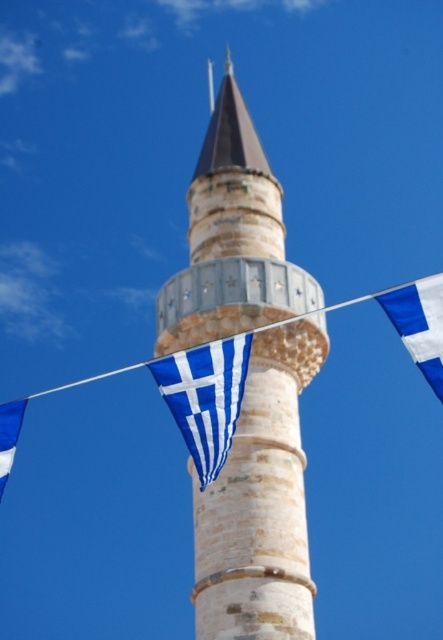
The image size is (443, 640). I want to click on blue striped flag at center, so click(x=205, y=397).

Does blue striped flag at center have a lesser width compared to blue fabric flag at right?

Yes, blue striped flag at center is thinner than blue fabric flag at right.

Does point (199, 456) come closer to viewer compared to point (427, 280)?

No, it is behind (427, 280).

Where is `blue striped flag at center`? blue striped flag at center is located at coordinates (205, 397).

How far apart are stone minaret at center and blue fabric flag at right?

stone minaret at center is 13.16 meters from blue fabric flag at right.

Who is more forward, (x=181, y=291) or (x=405, y=301)?

Point (x=405, y=301) is more forward.

Between point (253, 256) and point (431, 348), which one is positioned in front?

Positioned in front is point (431, 348).

Identify the location of stone minaret at center. This screenshot has width=443, height=640. (260, 502).

In the scene shown: Is stone minaret at center bigger than blue fabric flag at lower left?

Correct, stone minaret at center is larger in size than blue fabric flag at lower left.

Does stone minaret at center have a smaller size compared to blue fabric flag at lower left?

No, stone minaret at center is not smaller than blue fabric flag at lower left.

Between point (291, 358) and point (2, 416), which one is positioned behind?

Point (291, 358)

Locate an element on the screen. stone minaret at center is located at coordinates (260, 502).